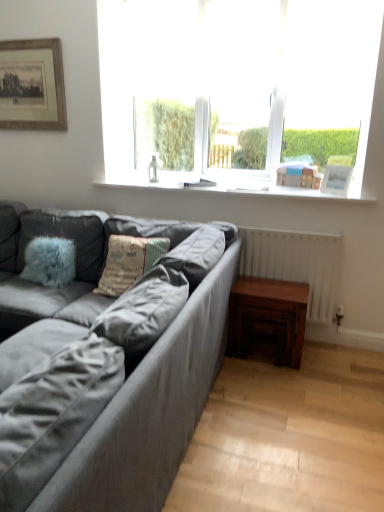
Question: From the image's perspective, is dark brown wooden table at lower right on white glossy picture frame at upper right, which ranks as the 2th picture frame in left-to-right order?

Choices:
 (A) no
 (B) yes

Answer: (A)

Question: Is dark brown wooden table at lower right outside white glossy picture frame at upper right, which is counted as the first picture frame, starting from the bottom?

Choices:
 (A) no
 (B) yes

Answer: (B)

Question: Are dark brown wooden table at lower right and white glossy picture frame at upper right, which ranks as the 2th picture frame in left-to-right order, located far from each other?

Choices:
 (A) no
 (B) yes

Answer: (A)

Question: Is dark brown wooden table at lower right positioned with its back to white glossy picture frame at upper right, which ranks as the 2th picture frame in left-to-right order?

Choices:
 (A) no
 (B) yes

Answer: (A)

Question: From the image's perspective, is dark brown wooden table at lower right below white glossy picture frame at upper right, which ranks as the 2th picture frame in left-to-right order?

Choices:
 (A) yes
 (B) no

Answer: (A)

Question: Is dark brown wooden table at lower right beside white glossy picture frame at upper right, arranged as the 2th picture frame when viewed from the back?

Choices:
 (A) no
 (B) yes

Answer: (A)

Question: From the image's perspective, is dark brown wooden table at lower right above transparent glass window at upper center?

Choices:
 (A) yes
 (B) no

Answer: (B)

Question: Is dark brown wooden table at lower right taller than transparent glass window at upper center?

Choices:
 (A) yes
 (B) no

Answer: (B)

Question: Considering the relative sizes of dark brown wooden table at lower right and transparent glass window at upper center in the image provided, is dark brown wooden table at lower right thinner than transparent glass window at upper center?

Choices:
 (A) no
 (B) yes

Answer: (A)

Question: From a real-world perspective, is dark brown wooden table at lower right below transparent glass window at upper center?

Choices:
 (A) no
 (B) yes

Answer: (B)

Question: Does dark brown wooden table at lower right come behind transparent glass window at upper center?

Choices:
 (A) no
 (B) yes

Answer: (A)

Question: Can you confirm if dark brown wooden table at lower right is positioned to the right of transparent glass window at upper center?

Choices:
 (A) no
 (B) yes

Answer: (B)

Question: From the image's perspective, would you say transparent glass window at upper center is shown under wooden framed print at upper left, arranged as the second picture frame when ordered from the bottom?

Choices:
 (A) yes
 (B) no

Answer: (A)